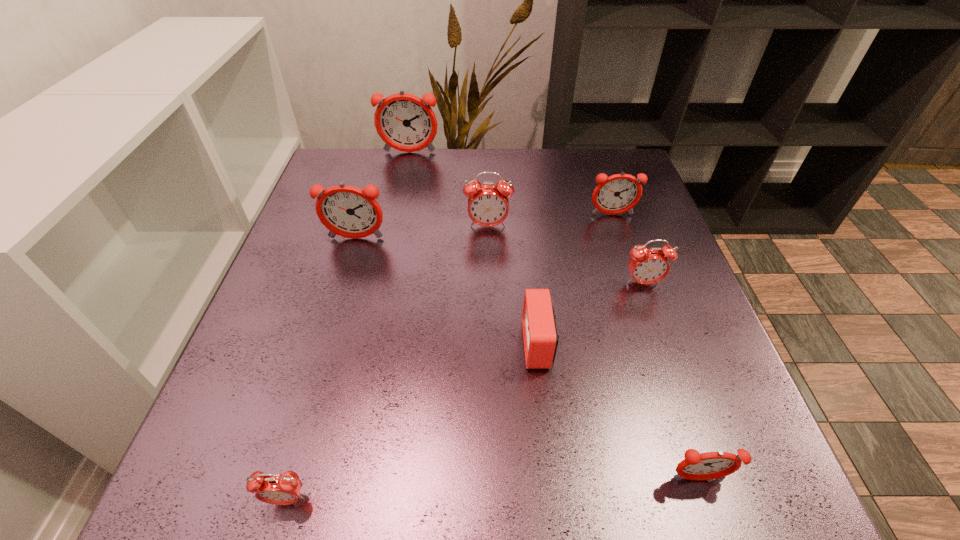
Locate an element on the screen. The width and height of the screenshot is (960, 540). the second nearest red alarm clock is located at coordinates (540, 336).

The image size is (960, 540). I want to click on the third nearest alarm clock, so click(x=540, y=336).

The image size is (960, 540). Identify the location of the second nearest object. (711, 465).

At what (x,y) coordinates should I click in order to perform the action: click on the smallest reddish-pink alarm clock. Please return your answer as a coordinate pair (x, y). The height and width of the screenshot is (540, 960). Looking at the image, I should click on (711, 465).

Locate an element on the screen. the nearest alarm clock is located at coordinates (280, 489).

You are a GUI agent. You are given a task and a screenshot of the screen. Output one action in this format:
    pyautogui.click(x=<x>, y=<y>)
    Task: Click on the nearest red alarm clock
    
    Given the screenshot: What is the action you would take?
    pyautogui.click(x=280, y=489)

This screenshot has width=960, height=540. What are the coordinates of `free point located 0.260m on the front-facing side of the tallest object` in the screenshot? It's located at (396, 213).

The image size is (960, 540). I want to click on vacant region located 0.310m on the front-facing side of the fourth farthest alarm clock, so click(x=321, y=360).

Locate an element on the screen. This screenshot has height=540, width=960. vacant area situated 0.370m on the face of the farthest red alarm clock is located at coordinates (491, 370).

Locate an element on the screen. free space located 0.250m on the front-facing side of the second smallest reddish-pink alarm clock is located at coordinates (639, 296).